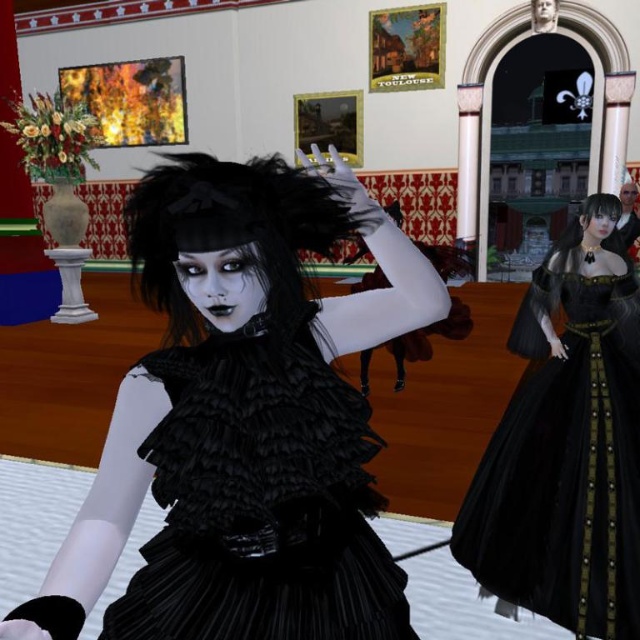
Question: Is matte black dress at center thinner than black satin gown at right?

Choices:
 (A) no
 (B) yes

Answer: (B)

Question: Among these points, which one is nearest to the camera?

Choices:
 (A) (532, 547)
 (B) (128, 500)

Answer: (B)

Question: Can you confirm if matte black dress at center is smaller than black satin gown at right?

Choices:
 (A) yes
 (B) no

Answer: (A)

Question: Does matte black dress at center have a smaller size compared to black satin gown at right?

Choices:
 (A) no
 (B) yes

Answer: (B)